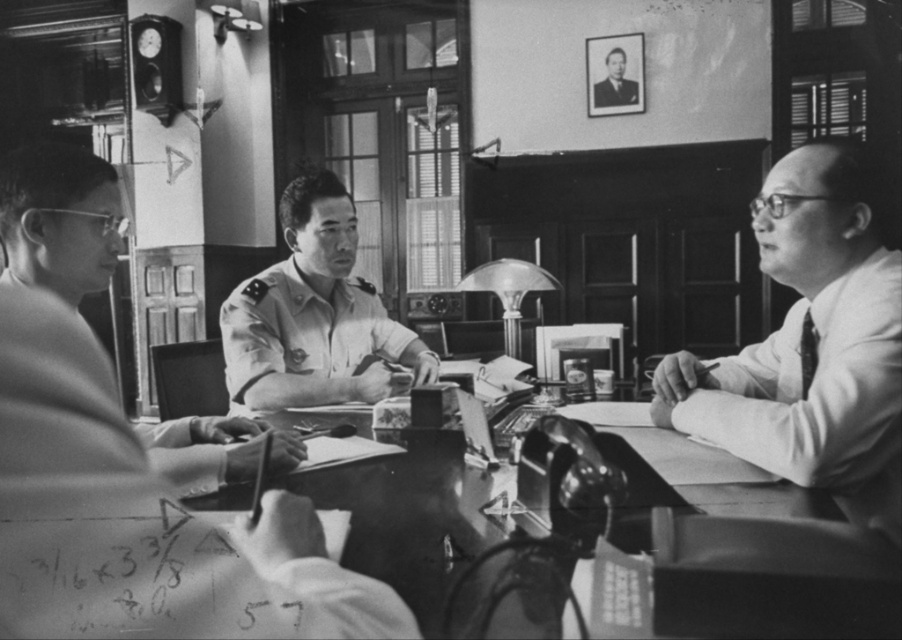
Is uniform at center to the right of smooth wooden table at center from the viewer's perspective?

In fact, uniform at center is to the left of smooth wooden table at center.

Between uniform at center and smooth wooden table at center, which one appears on the right side from the viewer's perspective?

Positioned to the right is smooth wooden table at center.

Is point (265, 376) closer to viewer compared to point (419, 509)?

No, (265, 376) is behind (419, 509).

Find the location of a particular element. This screenshot has height=640, width=902. uniform at center is located at coordinates (316, 316).

Measure the distance between uniformed officer at center and smooth white shirt at right.

They are 83.75 centimeters apart.

Is uniformed officer at center closer to the viewer compared to smooth white shirt at right?

Yes, it is.

Where is `uniformed officer at center`? This screenshot has height=640, width=902. uniformed officer at center is located at coordinates point(130,461).

Does uniformed officer at center appear under uniform at center?

Correct, uniformed officer at center is located below uniform at center.

Is uniformed officer at center taller than uniform at center?

No, uniformed officer at center is not taller than uniform at center.

Describe the element at coordinates (130, 461) in the screenshot. This screenshot has width=902, height=640. I see `uniformed officer at center` at that location.

Where is `uniformed officer at center`? The width and height of the screenshot is (902, 640). uniformed officer at center is located at coordinates (130, 461).